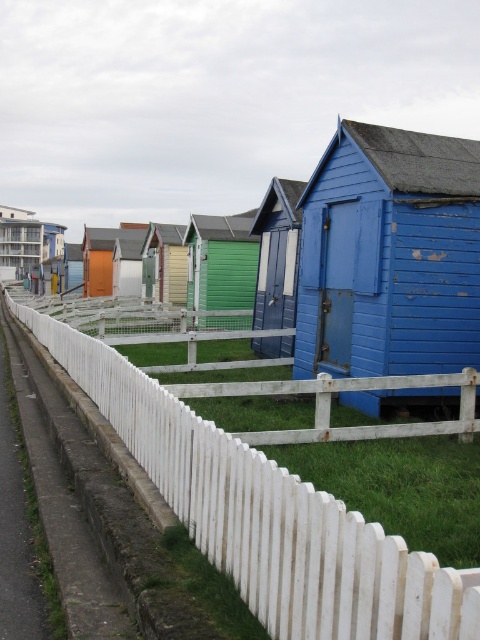
Question: Which of the following is the farthest from the observer?

Choices:
 (A) coord(407,614)
 (B) coord(153,278)
 (C) coord(24,234)

Answer: (C)

Question: Does white picket fence at lower left appear over green matte cabin at center?

Choices:
 (A) no
 (B) yes

Answer: (A)

Question: Which of the following is the closest to the observer?

Choices:
 (A) (45, 228)
 (B) (338, 301)
 (C) (115, 241)
 (D) (153, 294)

Answer: (B)

Question: Does blue wooden beach hut at center appear on the left side of green painted wood hut at center?

Choices:
 (A) no
 (B) yes

Answer: (A)

Question: Which point is closer to the camera?

Choices:
 (A) (156, 256)
 (B) (103, 291)

Answer: (A)

Question: Can you confirm if green matte cabin at center is wider than orange wood cabin at center?

Choices:
 (A) no
 (B) yes

Answer: (A)